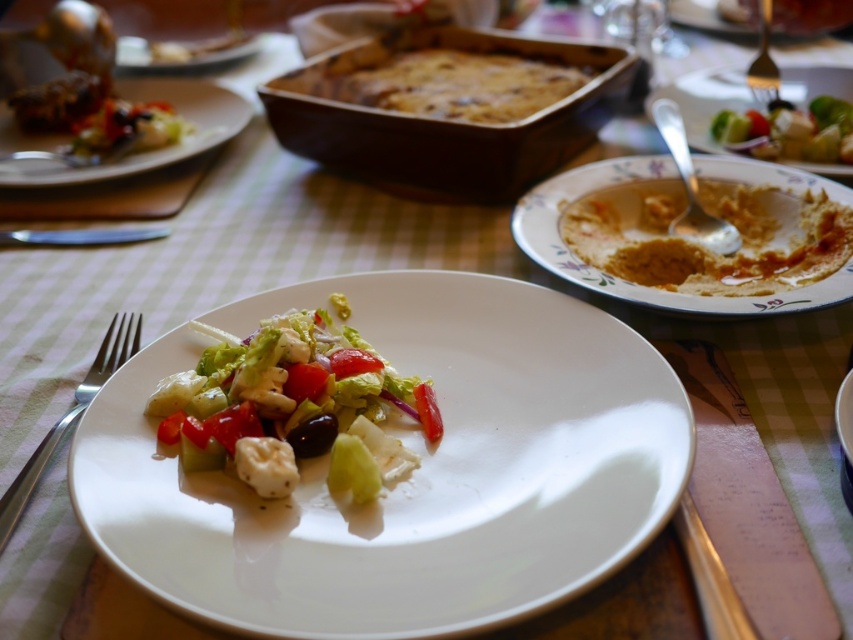
Image resolution: width=853 pixels, height=640 pixels. I want to click on fresh green salad at upper right, so click(788, 131).

Is point (764, 125) more distant than point (762, 28)?

No.

Between point (780, 104) and point (764, 68), which one is positioned behind?

Positioned behind is point (764, 68).

What are the coordinates of `fresh green salad at upper right` in the screenshot? It's located at (788, 131).

Does golden brown baked dish at center have a greater height compared to floral ceramic bowl at right?

No.

Who is higher up, golden brown baked dish at center or floral ceramic bowl at right?

golden brown baked dish at center is above.

Locate an element on the screen. The width and height of the screenshot is (853, 640). golden brown baked dish at center is located at coordinates (439, 81).

Does golden brown baked dish at center appear over silver metallic fork at left?

Yes.

Measure the distance between golden brown baked dish at center and silver metallic fork at left.

golden brown baked dish at center is 23.43 inches away from silver metallic fork at left.

Where is `golden brown baked dish at center`? Image resolution: width=853 pixels, height=640 pixels. golden brown baked dish at center is located at coordinates (439, 81).